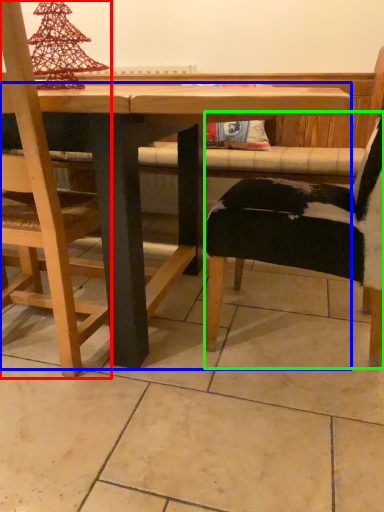
Question: Considering the real-world distances, which object is farthest from chair (highlighted by a red box)? table (highlighted by a blue box) or chair (highlighted by a green box)?

Choices:
 (A) table
 (B) chair

Answer: (B)